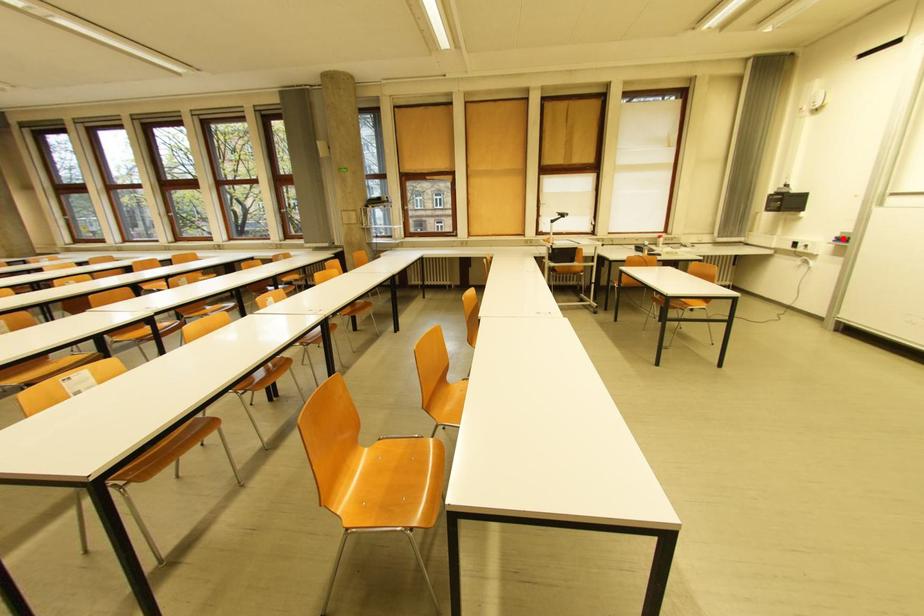
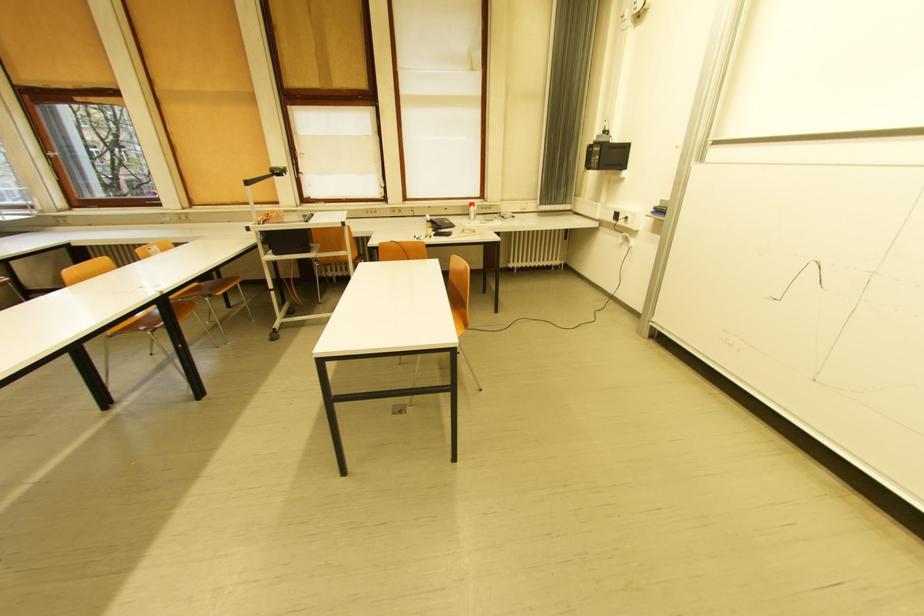
Question: I am providing you with two images of the same scene from different viewpoints. Image1 has a red point marked. In image2, the corresponding 3D location appears at what relative position? Reply with the corresponding letter.

Choices:
 (A) Closer
 (B) Farther

Answer: (A)